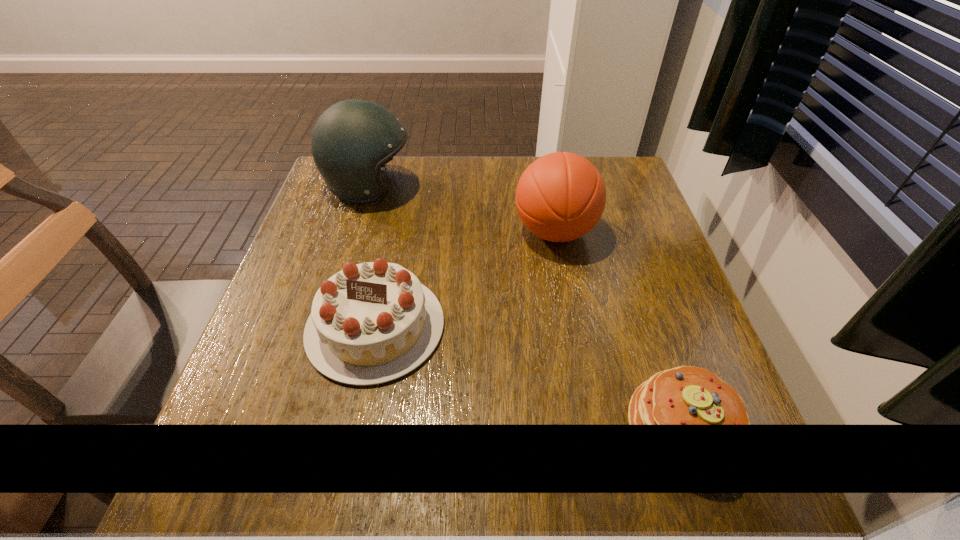
Identify the location of vacant area in the image that satisfies the following two spatial constraints: 1. on the back side of the basketball; 2. at the face opening of the football helmet. This screenshot has height=540, width=960. (546, 187).

Where is `blank space that satisfies the following two spatial constraints: 1. at the face opening of the shortest object; 2. on the left side of the football helmet`? The image size is (960, 540). blank space that satisfies the following two spatial constraints: 1. at the face opening of the shortest object; 2. on the left side of the football helmet is located at coordinates (297, 428).

Where is `free space in the image that satisfies the following two spatial constraints: 1. at the face opening of the second tallest object; 2. on the left side of the football helmet`? The width and height of the screenshot is (960, 540). free space in the image that satisfies the following two spatial constraints: 1. at the face opening of the second tallest object; 2. on the left side of the football helmet is located at coordinates (356, 232).

At what (x,y) coordinates should I click in order to perform the action: click on vacant area in the image that satisfies the following two spatial constraints: 1. at the face opening of the birthday cake; 2. on the left side of the football helmet. Please return your answer as a coordinate pair (x, y). The width and height of the screenshot is (960, 540). Looking at the image, I should click on (327, 327).

This screenshot has height=540, width=960. I want to click on free space that satisfies the following two spatial constraints: 1. at the face opening of the basketball; 2. on the left side of the football helmet, so click(x=356, y=232).

I want to click on free spot that satisfies the following two spatial constraints: 1. at the face opening of the third shortest object; 2. on the right side of the football helmet, so click(356, 232).

Locate an element on the screen. This screenshot has width=960, height=540. free location that satisfies the following two spatial constraints: 1. on the back side of the birthday cake; 2. at the face opening of the football helmet is located at coordinates (404, 187).